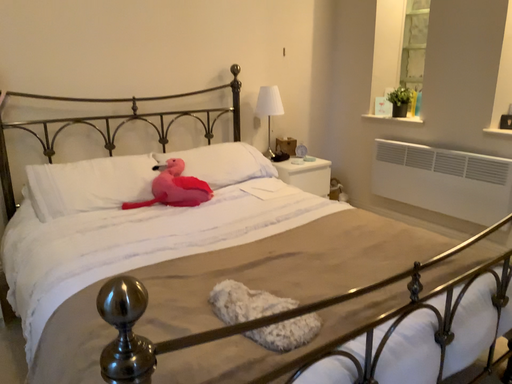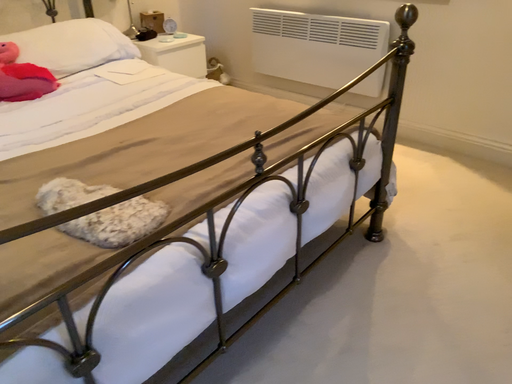
Question: Which way did the camera rotate in the video?

Choices:
 (A) rotated downward
 (B) rotated upward

Answer: (A)